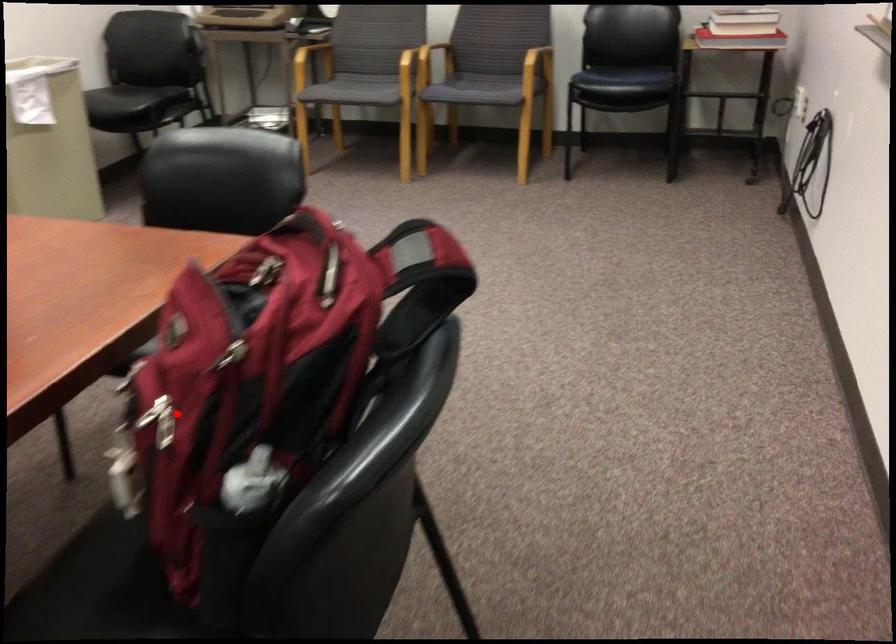
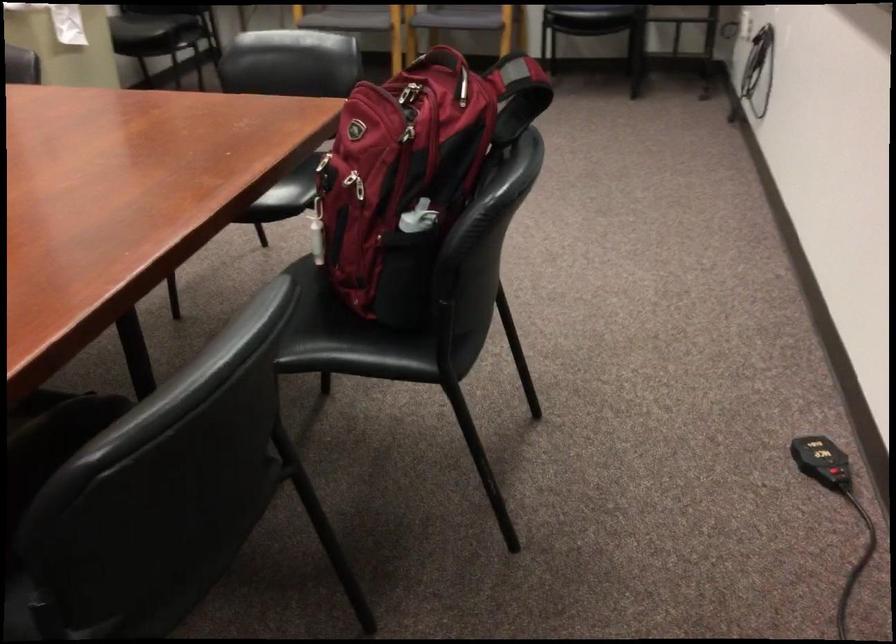
In the second image, find the point that corresponds to the highlighted location in the first image.

(355, 184)